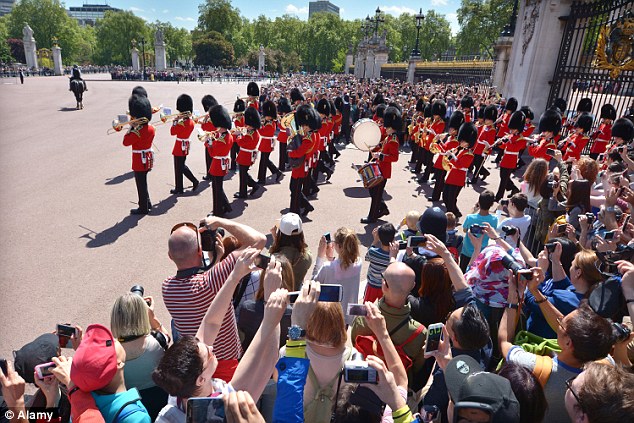
The image size is (634, 423). What are the coordinates of `decorative ceramic pillar` in the screenshot? It's located at (534, 73).